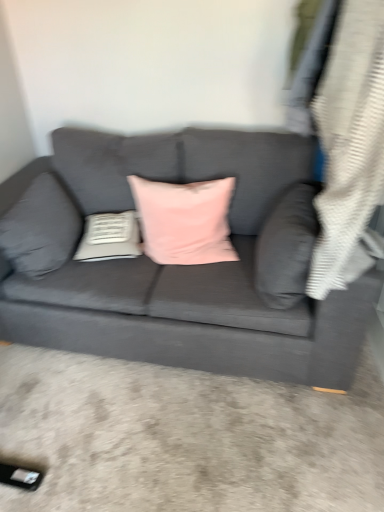
Where is `matte gray pillow at right, which is counted as the 1th pillow, starting from the right`? matte gray pillow at right, which is counted as the 1th pillow, starting from the right is located at coordinates (287, 247).

Describe the element at coordinates (41, 228) in the screenshot. This screenshot has width=384, height=512. I see `matte gray pillow at left, the 4th pillow when ordered from right to left` at that location.

What are the coordinates of `white textured pillow at center, the 3th pillow viewed from the right` in the screenshot? It's located at (109, 237).

The height and width of the screenshot is (512, 384). In order to click on matte gray pillow at right, which is counted as the 1th pillow, starting from the right in this screenshot , I will do pyautogui.click(x=287, y=247).

From a real-world perspective, is pink velvet pillow at center, which ranks as the second pillow in right-to-left order, on matte gray pillow at right, which is counted as the 1th pillow, starting from the right?

No, from a real-world perspective, pink velvet pillow at center, which ranks as the second pillow in right-to-left order, is not on top of matte gray pillow at right, which is counted as the 1th pillow, starting from the right.

Looking at this image, who is more distant, pink velvet pillow at center, which ranks as the second pillow in right-to-left order, or matte gray pillow at right, the fourth pillow when ordered from left to right?

Positioned behind is pink velvet pillow at center, which ranks as the second pillow in right-to-left order.

Between pink velvet pillow at center, which ranks as the second pillow in right-to-left order, and matte gray pillow at right, which is counted as the 1th pillow, starting from the right, which one has less height?

pink velvet pillow at center, which ranks as the second pillow in right-to-left order.

Considering the sizes of objects matte gray couch at center and matte gray pillow at right, the fourth pillow when ordered from left to right, in the image provided, who is wider, matte gray couch at center or matte gray pillow at right, the fourth pillow when ordered from left to right,?

Wider between the two is matte gray couch at center.

Is matte gray couch at center turned away from matte gray pillow at right, the fourth pillow when ordered from left to right?

Yes, matte gray couch at center is facing away from matte gray pillow at right, the fourth pillow when ordered from left to right.

Can we say matte gray couch at center lies outside matte gray pillow at right, which is counted as the 1th pillow, starting from the right?

Yes, matte gray couch at center is located beyond the bounds of matte gray pillow at right, which is counted as the 1th pillow, starting from the right.

In the image, is matte gray couch at center on the left side or the right side of matte gray pillow at right, which is counted as the 1th pillow, starting from the right?

Clearly, matte gray couch at center is on the left of matte gray pillow at right, which is counted as the 1th pillow, starting from the right, in the image.

Does white textured pillow at center, the 3th pillow viewed from the right, have a lesser height compared to matte gray pillow at right, the fourth pillow when ordered from left to right?

Yes.

Based on the photo, which object is positioned more to the left, white textured pillow at center, the 3th pillow viewed from the right, or matte gray pillow at right, which is counted as the 1th pillow, starting from the right?

From the viewer's perspective, white textured pillow at center, the 3th pillow viewed from the right, appears more on the left side.

Would you say matte gray pillow at right, which is counted as the 1th pillow, starting from the right, is part of white textured pillow at center, the 2th pillow viewed from the left,'s contents?

Definitely not — matte gray pillow at right, which is counted as the 1th pillow, starting from the right, is not inside white textured pillow at center, the 2th pillow viewed from the left.

Is white textured pillow at center, the 2th pillow viewed from the left, facing away from matte gray pillow at right, the fourth pillow when ordered from left to right?

white textured pillow at center, the 2th pillow viewed from the left, does not have its back to matte gray pillow at right, the fourth pillow when ordered from left to right.

Consider the image. Looking at the image, does matte gray couch at center seem bigger or smaller compared to matte gray pillow at left, marked as the 1th pillow in a left-to-right arrangement?

Considering their sizes, matte gray couch at center takes up more space than matte gray pillow at left, marked as the 1th pillow in a left-to-right arrangement.

Is point (194, 313) closer to camera compared to point (12, 243)?

That is True.

Who is taller, matte gray couch at center or matte gray pillow at left, marked as the 1th pillow in a left-to-right arrangement?

Standing taller between the two is matte gray couch at center.

Does matte gray pillow at left, the 4th pillow when ordered from right to left, have a smaller size compared to pink velvet pillow at center, the 3th pillow in the left-to-right sequence?

Indeed, matte gray pillow at left, the 4th pillow when ordered from right to left, has a smaller size compared to pink velvet pillow at center, the 3th pillow in the left-to-right sequence.

Which object is further away from the camera, matte gray pillow at left, the 4th pillow when ordered from right to left, or pink velvet pillow at center, which ranks as the second pillow in right-to-left order?

pink velvet pillow at center, which ranks as the second pillow in right-to-left order, is further from the camera.

Which point is more forward, (x=55, y=264) or (x=173, y=229)?

The point (x=55, y=264) is closer.

How different are the orientations of pink velvet pillow at center, the 3th pillow in the left-to-right sequence, and matte gray pillow at left, the 4th pillow when ordered from right to left, in degrees?

They differ by 87.2 degrees in their facing directions.

Is pink velvet pillow at center, the 3th pillow in the left-to-right sequence, thinner than matte gray pillow at left, the 4th pillow when ordered from right to left?

In fact, pink velvet pillow at center, the 3th pillow in the left-to-right sequence, might be wider than matte gray pillow at left, the 4th pillow when ordered from right to left.

Is pink velvet pillow at center, the 3th pillow in the left-to-right sequence, positioned behind matte gray pillow at left, marked as the 1th pillow in a left-to-right arrangement?

Yes, it is.

Considering the relative positions of pink velvet pillow at center, which ranks as the second pillow in right-to-left order, and matte gray pillow at left, marked as the 1th pillow in a left-to-right arrangement, in the image provided, is pink velvet pillow at center, which ranks as the second pillow in right-to-left order, to the left or to the right of matte gray pillow at left, marked as the 1th pillow in a left-to-right arrangement,?

Based on their positions, pink velvet pillow at center, which ranks as the second pillow in right-to-left order, is located to the right of matte gray pillow at left, marked as the 1th pillow in a left-to-right arrangement.

Is matte gray couch at center in contact with pink velvet pillow at center, which ranks as the second pillow in right-to-left order?

matte gray couch at center and pink velvet pillow at center, which ranks as the second pillow in right-to-left order, are not in contact.

Identify the location of the 3rd pillow behind the matte gray couch at center. (184, 220).

Does matte gray couch at center have a larger size compared to pink velvet pillow at center, the 3th pillow in the left-to-right sequence?

Indeed, matte gray couch at center has a larger size compared to pink velvet pillow at center, the 3th pillow in the left-to-right sequence.

From a real-world perspective, is matte gray couch at center above or below pink velvet pillow at center, which ranks as the second pillow in right-to-left order?

From a real-world perspective, matte gray couch at center is physically below pink velvet pillow at center, which ranks as the second pillow in right-to-left order.

You are a GUI agent. You are given a task and a screenshot of the screen. Output one action in this format:
    pyautogui.click(x=<x>, y=<y>)
    Task: Click on the pillow on the right of pink velvet pillow at center, which ranks as the second pillow in right-to-left order
    
    Given the screenshot: What is the action you would take?
    pyautogui.click(x=287, y=247)

I want to click on pillow that is the 4th one above the matte gray couch at center (from a real-world perspective), so click(287, 247).

Considering their positions, is pink velvet pillow at center, which ranks as the second pillow in right-to-left order, positioned closer to matte gray pillow at right, which is counted as the 1th pillow, starting from the right, than white textured pillow at center, the 2th pillow viewed from the left?

Based on the image, pink velvet pillow at center, which ranks as the second pillow in right-to-left order, appears to be nearer to matte gray pillow at right, which is counted as the 1th pillow, starting from the right.

When comparing their distances from matte gray couch at center, does matte gray pillow at right, which is counted as the 1th pillow, starting from the right, or pink velvet pillow at center, the 3th pillow in the left-to-right sequence, seem closer?

pink velvet pillow at center, the 3th pillow in the left-to-right sequence, is closer to matte gray couch at center.

Based on their spatial positions, is white textured pillow at center, the 3th pillow viewed from the right, or matte gray couch at center closer to matte gray pillow at left, marked as the 1th pillow in a left-to-right arrangement?

The object closer to matte gray pillow at left, marked as the 1th pillow in a left-to-right arrangement, is white textured pillow at center, the 3th pillow viewed from the right.

From the image, which object appears to be nearer to matte gray pillow at right, the fourth pillow when ordered from left to right, pink velvet pillow at center, the 3th pillow in the left-to-right sequence, or matte gray pillow at left, marked as the 1th pillow in a left-to-right arrangement?

pink velvet pillow at center, the 3th pillow in the left-to-right sequence, lies closer to matte gray pillow at right, the fourth pillow when ordered from left to right, than the other object.

Considering their positions, is matte gray pillow at right, which is counted as the 1th pillow, starting from the right, positioned further to matte gray pillow at left, marked as the 1th pillow in a left-to-right arrangement, than matte gray couch at center?

Among the two, matte gray pillow at right, which is counted as the 1th pillow, starting from the right, is located further to matte gray pillow at left, marked as the 1th pillow in a left-to-right arrangement.

Looking at this image, based on their spatial positions, is matte gray couch at center or matte gray pillow at right, the fourth pillow when ordered from left to right, closer to white textured pillow at center, the 2th pillow viewed from the left?

matte gray couch at center lies closer to white textured pillow at center, the 2th pillow viewed from the left, than the other object.

Which object lies further to the anchor point white textured pillow at center, the 3th pillow viewed from the right, matte gray couch at center or matte gray pillow at left, the 4th pillow when ordered from right to left?

Among the two, matte gray couch at center is located further to white textured pillow at center, the 3th pillow viewed from the right.

Which object lies further to the anchor point pink velvet pillow at center, the 3th pillow in the left-to-right sequence, white textured pillow at center, the 3th pillow viewed from the right, or matte gray pillow at left, marked as the 1th pillow in a left-to-right arrangement?

matte gray pillow at left, marked as the 1th pillow in a left-to-right arrangement, is further to pink velvet pillow at center, the 3th pillow in the left-to-right sequence.

The width and height of the screenshot is (384, 512). I want to click on studio couch located between white textured pillow at center, the 2th pillow viewed from the left, and matte gray pillow at right, which is counted as the 1th pillow, starting from the right, in the left-right direction, so click(x=183, y=266).

Find the location of `studio couch between matte gray pillow at left, marked as the 1th pillow in a left-to-right arrangement, and pink velvet pillow at center, the 3th pillow in the left-to-right sequence, in the horizontal direction`. studio couch between matte gray pillow at left, marked as the 1th pillow in a left-to-right arrangement, and pink velvet pillow at center, the 3th pillow in the left-to-right sequence, in the horizontal direction is located at coordinates (183, 266).

I want to click on pillow between white textured pillow at center, the 3th pillow viewed from the right, and matte gray pillow at right, the fourth pillow when ordered from left to right, from left to right, so click(x=184, y=220).

The height and width of the screenshot is (512, 384). I want to click on pillow situated between matte gray couch at center and matte gray pillow at right, which is counted as the 1th pillow, starting from the right, from left to right, so click(x=184, y=220).